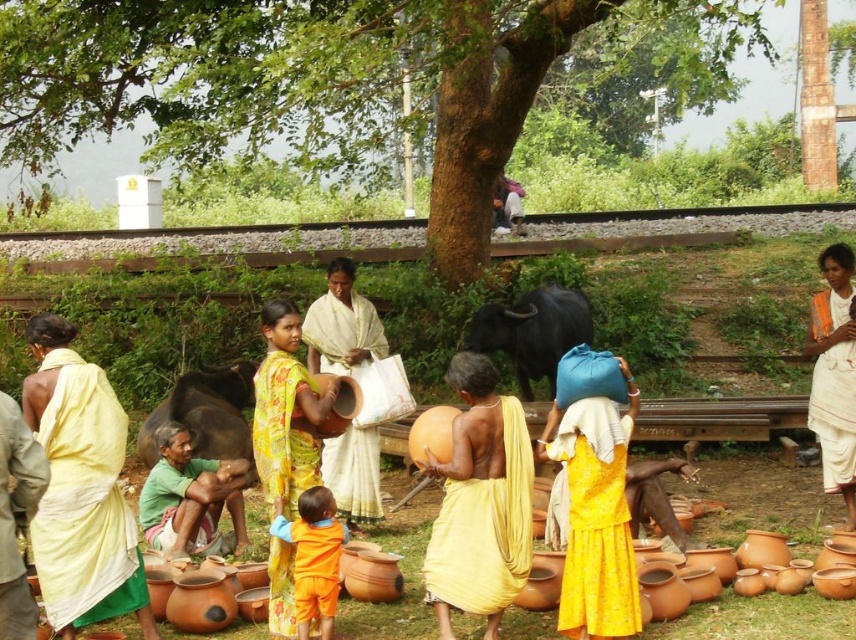
From the picture: You are a photographer trying to capture the vibrant colors of the yellow printed saree at center and the white cotton saree at center. Since you want to highlight both, which saree should you focus on to ensure the smaller one is still visible in the frame?

The yellow printed saree at center is smaller in size compared to the white cotton saree at center. To ensure both are visible, focus on the white cotton saree at center while keeping the yellow printed saree at center within the frame.

You are a photographer standing in front of the two women wearing the yellow printed saree at center and the white cotton saree at center. Which saree is positioned closer to you?

The yellow printed saree at center is closer to the viewer than the white cotton saree at center.